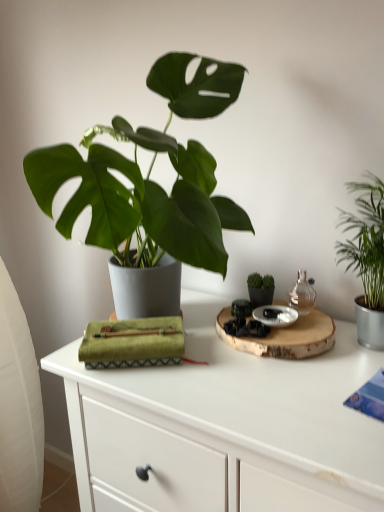
You are a GUI agent. You are given a task and a screenshot of the screen. Output one action in this format:
    pyautogui.click(x=<x>, y=<y>)
    Task: Click on the free space in front of transparent glass bottle at upper right
    
    Given the screenshot: What is the action you would take?
    pyautogui.click(x=318, y=362)